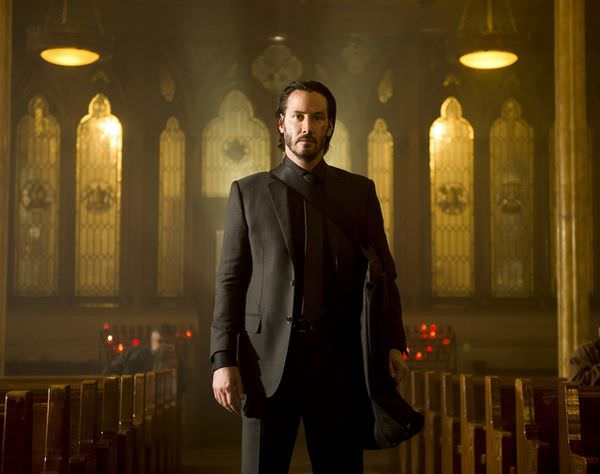
Identify the location of candles. The image size is (600, 474). (429, 329).